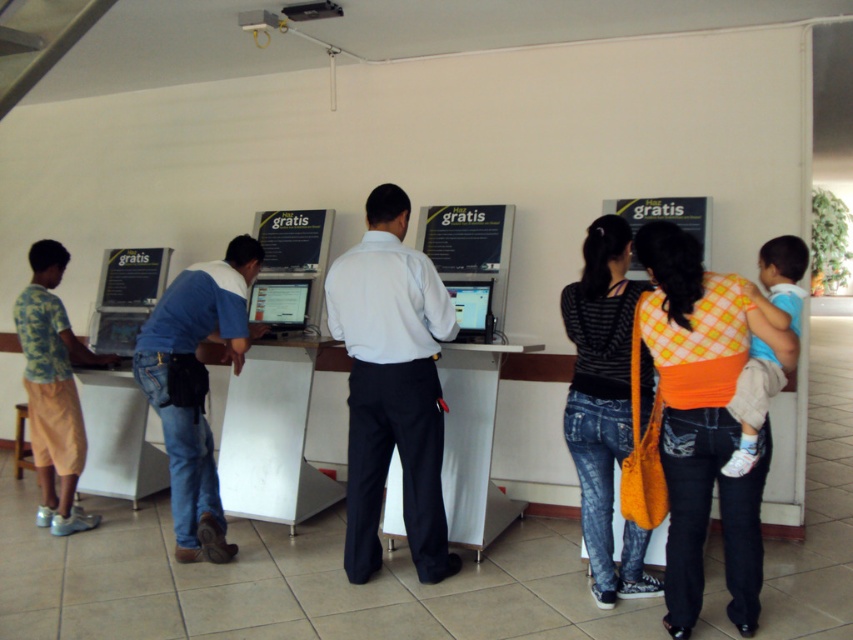
You are a maintenance worker who needs to reach both the white shirt at center and the camo shirt at left to fix a nearby electrical issue. If your tool box is 2 meters wide, can you carry both individuals at the same time while moving?

The white shirt at center is 1.93 meters from the camo shirt at left. Since your toolbox is 2 meters wide, you can carry both individuals at the same time while moving because the distance between them is slightly less than the toolbox width.

You are a maintenance worker who needs to check the distance between the denim jeans at center and the nearest computer kiosk. The safety regulation requires at least 3 meters between them. Is the current distance compliant?

The denim jeans at center are 3.10 meters away from the nearest computer kiosk, which meets the safety regulation requirement of at least 3 meters.

You are standing at the computer station and want to determine which of the two points, point (450, 326) or point (190, 342), is closer to you. Based on the description, which point is nearer?

Point (450, 326) is closer to the camera than point (190, 342).